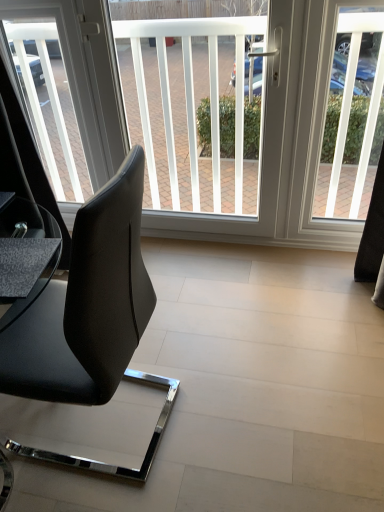
At what (x,y) coordinates should I click in order to perform the action: click on free point to the right of white plastic window screen at center, the 2th window screen in the left-to-right sequence. Please return your answer as a coordinate pair (x, y). This screenshot has width=384, height=512. Looking at the image, I should click on (294, 266).